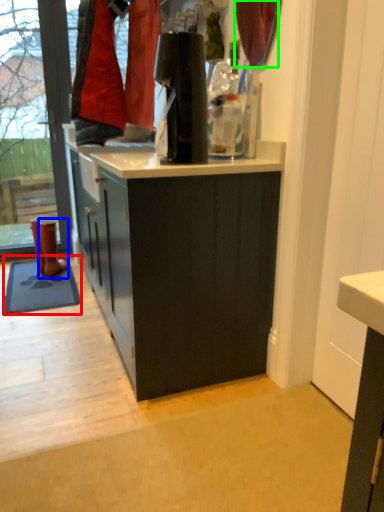
Question: Which is farther away from mat (highlighted by a red box)? footwear (highlighted by a blue box) or curtain (highlighted by a green box)?

Choices:
 (A) footwear
 (B) curtain

Answer: (B)